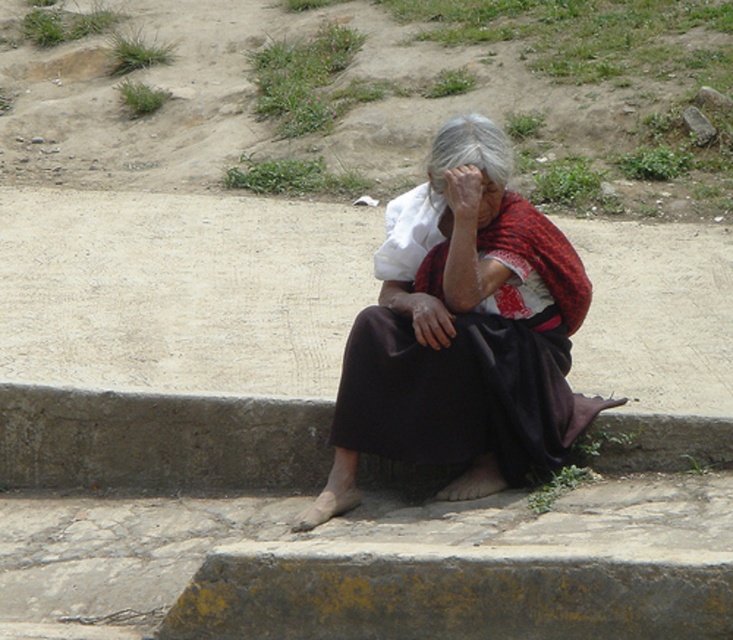
You are a photographer trying to capture a portrait of the elderly woman. You need to ensure that both the dark brown fabric skirt at center and the smooth skin face at center are in focus. Given that your camera can only focus on objects within a 10 inch range, will both elements be in focus?

The dark brown fabric skirt at center is 12.70 inches away from the smooth skin face at center. Since the distance between them exceeds the camera focus range of 10 inches, the camera cannot keep both in focus simultaneously.

You are a passerby who notices the elderly woman on the curb. You want to approach her to offer help. Which object should you focus on first to determine her immediate needs? The dark brown fabric skirt at center or the smooth skin face at center?

You should focus on the smooth skin face at center first because it is to the left of the dark brown fabric skirt at center, making it closer to you from your perspective. Assessing her facial expressions can help determine her immediate needs before addressing other aspects.